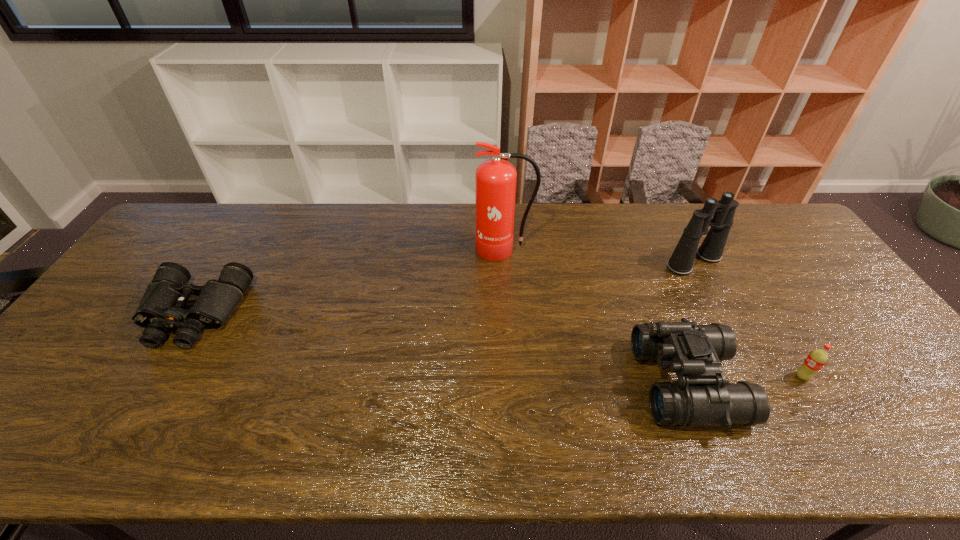
I want to click on the tallest object, so click(495, 179).

I want to click on fire extinguisher, so click(x=495, y=179).

Where is `the fourth shortest object`? The width and height of the screenshot is (960, 540). the fourth shortest object is located at coordinates (711, 250).

You are a GUI agent. You are given a task and a screenshot of the screen. Output one action in this format:
    pyautogui.click(x=<x>, y=<y>)
    Task: Click on the farthest binoculars
    The image size is (960, 540).
    Given the screenshot: What is the action you would take?
    pyautogui.click(x=711, y=250)

The height and width of the screenshot is (540, 960). What are the coordinates of `the second shortest binoculars` in the screenshot? It's located at (x=702, y=396).

Identify the location of soda. (817, 358).

Find the location of a particular element. This screenshot has width=960, height=540. the fourth tallest object is located at coordinates (817, 358).

You are a GUI agent. You are given a task and a screenshot of the screen. Output one action in this format:
    pyautogui.click(x=<x>, y=<y>)
    Task: Click on the shortest object
    
    Given the screenshot: What is the action you would take?
    pyautogui.click(x=161, y=308)

Image resolution: width=960 pixels, height=540 pixels. I want to click on the shortest binoculars, so click(161, 308).

This screenshot has width=960, height=540. What are the coordinates of `free location located 0.180m towards the nozzle of the fourth object from right to left` in the screenshot? It's located at (508, 304).